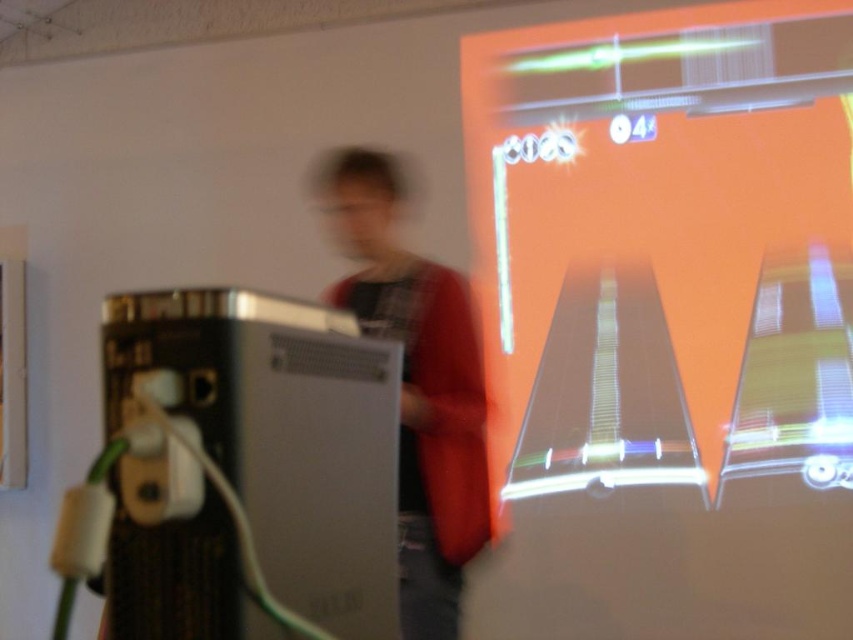
You are setting up a gaming system in a room. You have the metallic silver console at left and the orange glossy projection screen at upper right. According to the scene, where should you place the console relative to the screen to ensure proper setup?

The metallic silver console at left is behind the orange glossy projection screen at upper right in the scene, so you should place the console behind the screen for proper setup.

You are navigating a drone through the projected game scene. There are two points marked as point 1 at coordinates point (704,202) and point 2 at coordinates point (465,312). Which point is closer to the front of the projection screen?

Point 2 at coordinates point (465,312) is closer to the front of the projection screen because point 1 at coordinates point (704,202) is behind it.